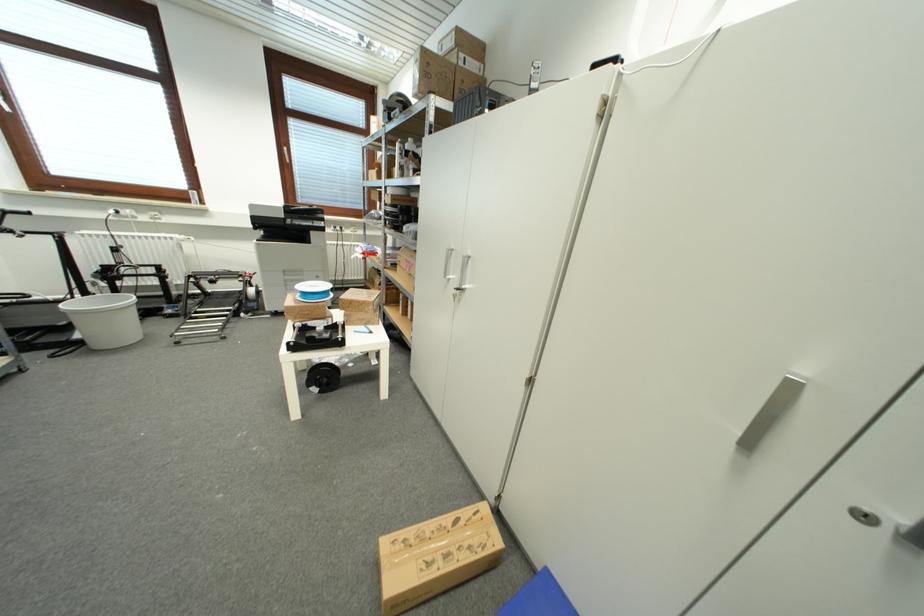
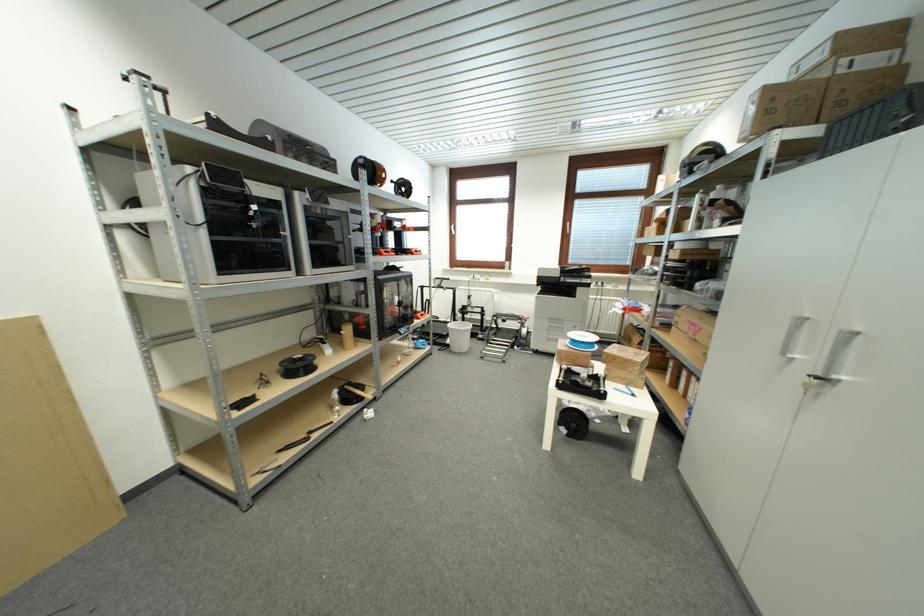
Find the pixel in the second image that matches (466,92) in the first image.

(845, 106)